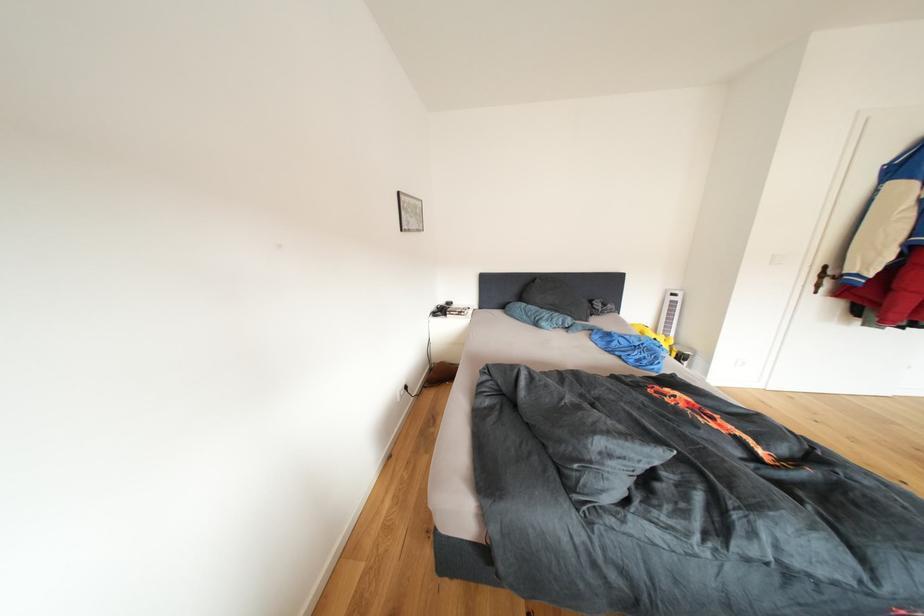
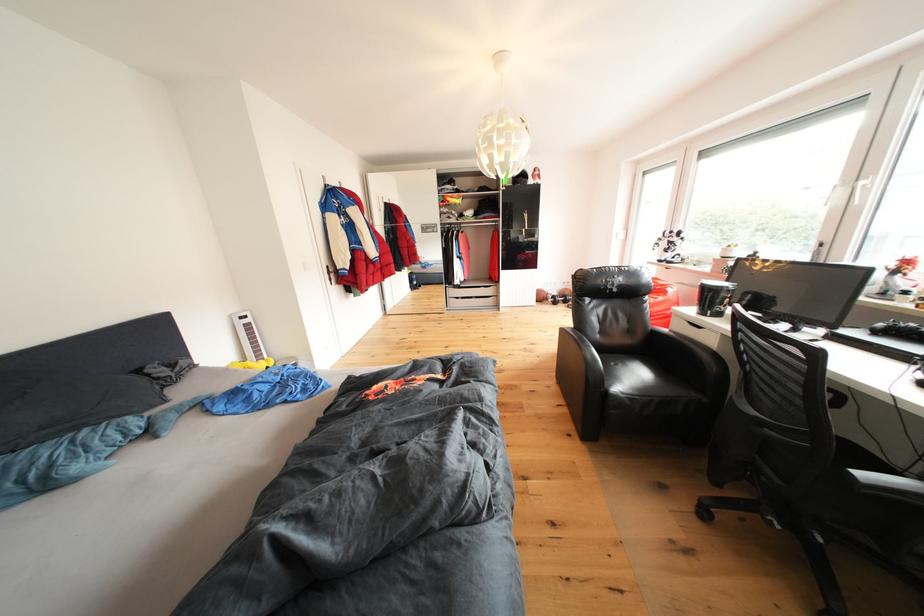
Find the pixel in the second image that matches point (682, 308) in the first image.

(257, 331)